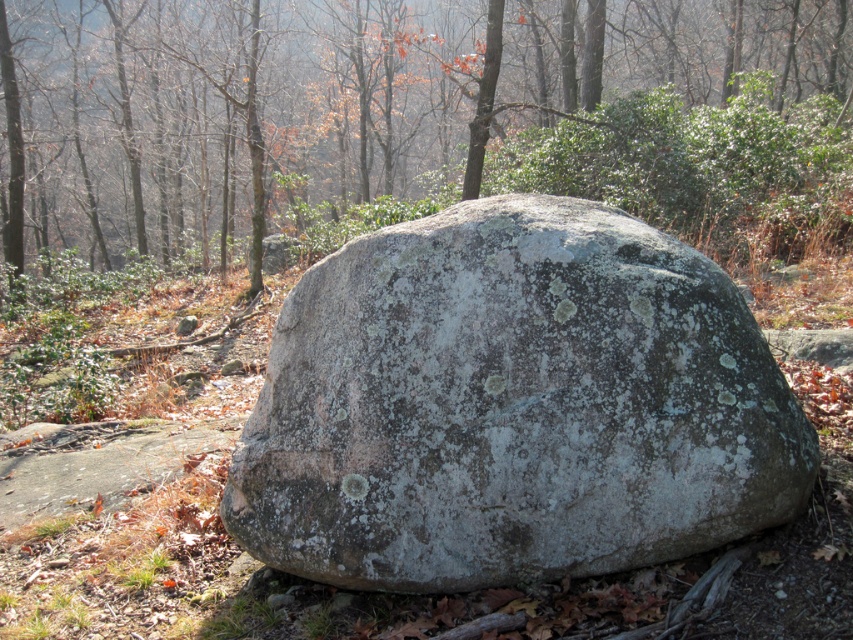
You are standing in a forest during autumn. You see a point marked at coordinates (416, 122). What object is located at that point?

The point at coordinates (416, 122) indicates a green lichen covered rock at center.